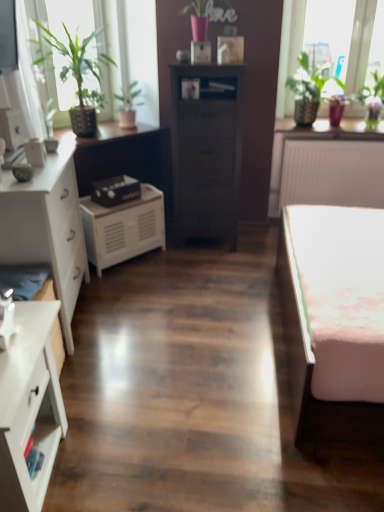
You are a GUI agent. You are given a task and a screenshot of the screen. Output one action in this format:
    pyautogui.click(x=<x>, y=<y>)
    Task: Click on the vacant area that is situated to the right of white glossy chest of drawers at lower left, placed as the 1th chest of drawers when sorted from front to back
    This screenshot has width=384, height=512.
    Given the screenshot: What is the action you would take?
    pyautogui.click(x=122, y=454)